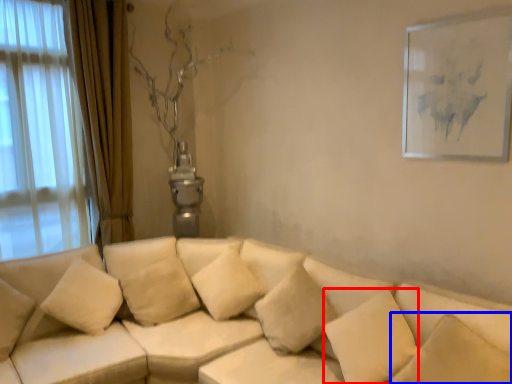
Question: Which of the following is the farthest to the observer, pillow (highlighted by a red box) or pillow (highlighted by a blue box)?

Choices:
 (A) pillow
 (B) pillow

Answer: (A)